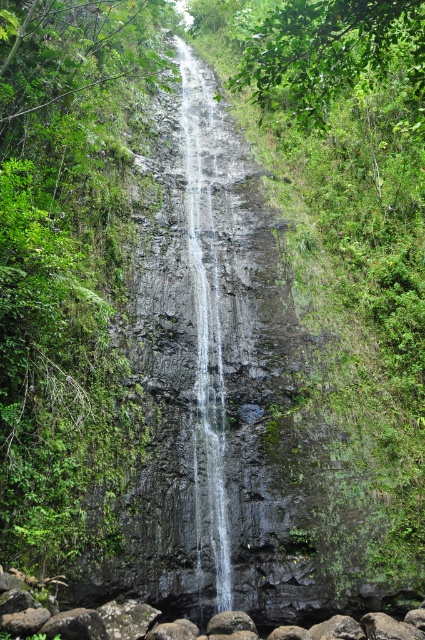
Which of these two, clear water at center or smooth gray rock at center, stands shorter?

Standing shorter between the two is smooth gray rock at center.

Based on the photo, between clear water at center and smooth gray rock at center, which one appears on the right side from the viewer's perspective?

smooth gray rock at center

Between point (206, 228) and point (175, 634), which one is positioned in front?

Point (175, 634) is in front.

Find the location of a particular element. This screenshot has height=640, width=425. clear water at center is located at coordinates (204, 326).